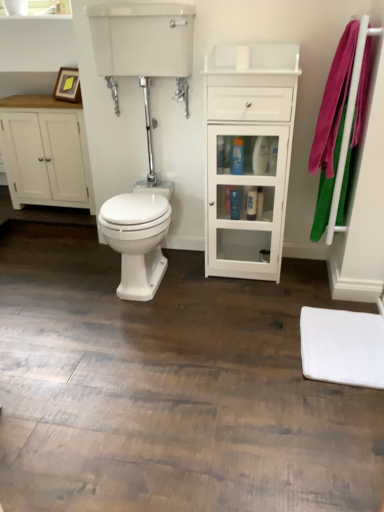
Question: Considering the relative sizes of white glossy cabinet at center and white glossy tank at upper center in the image provided, is white glossy cabinet at center bigger than white glossy tank at upper center?

Choices:
 (A) yes
 (B) no

Answer: (A)

Question: Would you say white glossy cabinet at center is outside white glossy tank at upper center?

Choices:
 (A) yes
 (B) no

Answer: (A)

Question: Considering the relative sizes of white glossy cabinet at center and white glossy tank at upper center in the image provided, is white glossy cabinet at center smaller than white glossy tank at upper center?

Choices:
 (A) yes
 (B) no

Answer: (B)

Question: From a real-world perspective, is white glossy cabinet at center beneath white glossy tank at upper center?

Choices:
 (A) no
 (B) yes

Answer: (B)

Question: Does white glossy cabinet at center appear on the right side of white glossy tank at upper center?

Choices:
 (A) no
 (B) yes

Answer: (B)

Question: Is white glossy cabinet at center to the left of white glossy tank at upper center from the viewer's perspective?

Choices:
 (A) yes
 (B) no

Answer: (B)

Question: Does white glossy tank at upper center appear on the left side of wooden picture frame at upper left?

Choices:
 (A) no
 (B) yes

Answer: (A)

Question: Considering the relative sizes of white glossy tank at upper center and wooden picture frame at upper left in the image provided, is white glossy tank at upper center shorter than wooden picture frame at upper left?

Choices:
 (A) no
 (B) yes

Answer: (A)

Question: Could you tell me if white glossy tank at upper center is turned towards wooden picture frame at upper left?

Choices:
 (A) no
 (B) yes

Answer: (A)

Question: Can you confirm if white glossy tank at upper center is wider than wooden picture frame at upper left?

Choices:
 (A) no
 (B) yes

Answer: (B)

Question: Is the position of white glossy tank at upper center more distant than that of wooden picture frame at upper left?

Choices:
 (A) yes
 (B) no

Answer: (B)

Question: Does white glossy tank at upper center have a greater height compared to wooden picture frame at upper left?

Choices:
 (A) yes
 (B) no

Answer: (A)

Question: Can you confirm if pink fabric bath towel at right is positioned to the right of white glossy cabinet at center?

Choices:
 (A) yes
 (B) no

Answer: (A)